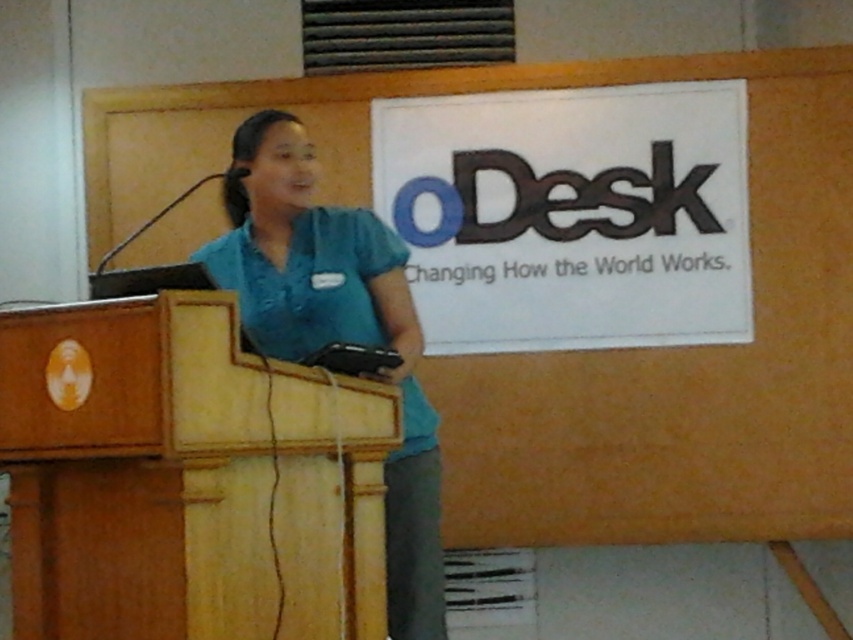
You are a photographer trying to capture a closeup of the two points in the image. Which point, point (132, 477) or point (279, 182), would appear larger in your photo?

Point (132, 477) is closer to the camera than point (279, 182), so it would appear larger in the photo.

You are a photographer standing in front of the wooden podium at center and the teal fabric shirt at center. You want to take a photo that includes both objects in the frame. Based on their distance, will you need to zoom in or zoom out to ensure both are fully visible?

The wooden podium at center and teal fabric shirt at center are 16.44 inches apart from each other. To include both in the frame, you would need to zoom out slightly to ensure both objects are fully visible within the photo.